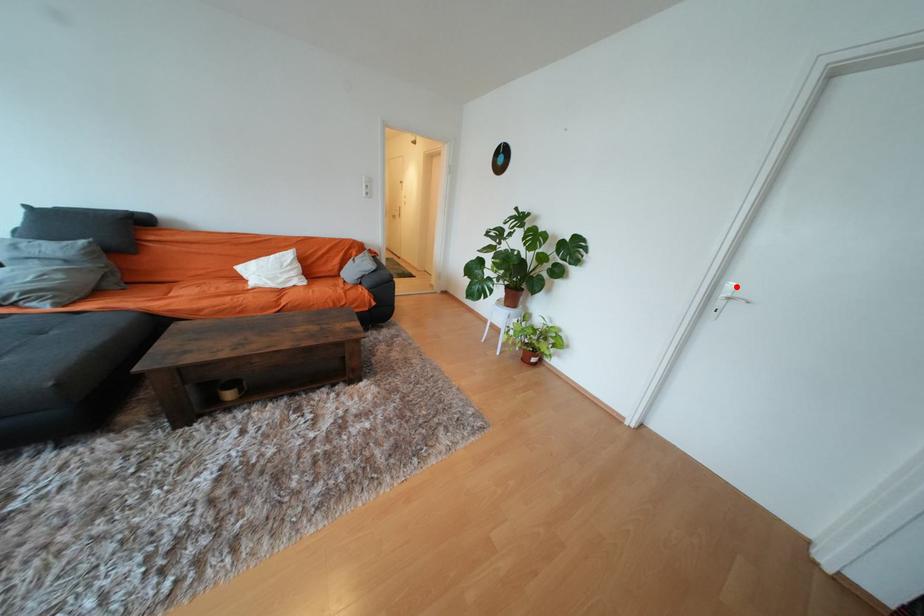
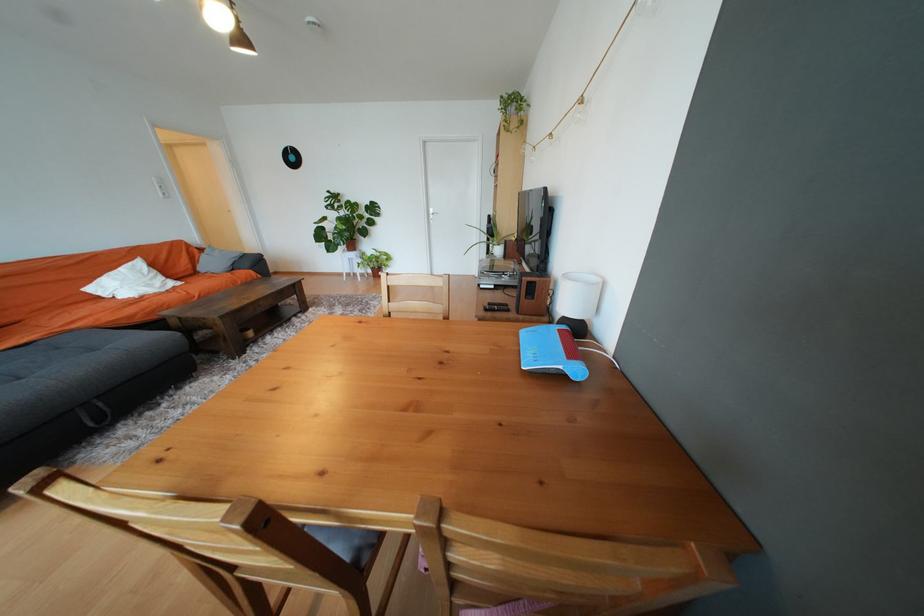
Question: I am providing you with two images of the same scene from different viewpoints. A red point is shown in image1. For the corresponding object point in image2, is it positioned nearer or farther from the camera?

Choices:
 (A) Nearer
 (B) Farther

Answer: (A)